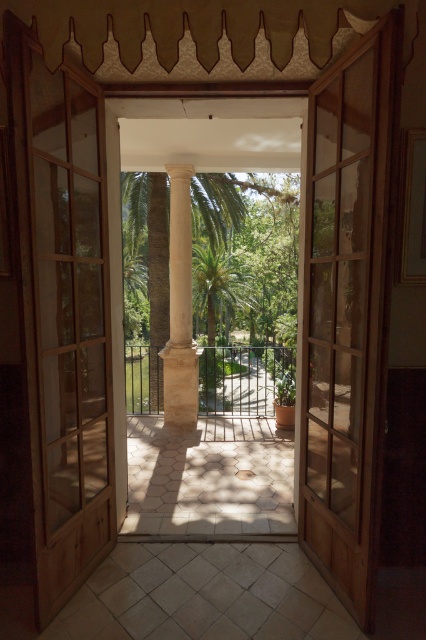
Between clear wood glass door at center and wooden door at center, which one has less height?

With less height is clear wood glass door at center.

Is clear wood glass door at center taller than wooden door at center?

Incorrect, clear wood glass door at center's height is not larger of wooden door at center's.

Which is in front, point (45, 525) or point (348, 96)?

Point (45, 525) is in front.

Identify the location of clear wood glass door at center. (66, 323).

Between clear wood glass door at center and white stone column at center, which one appears on the left side from the viewer's perspective?

clear wood glass door at center is more to the left.

Is point (54, 410) behind point (190, 324)?

That is False.

I want to click on clear wood glass door at center, so click(x=66, y=323).

Is wooden door at center to the right of white stone column at center from the viewer's perspective?

Correct, you'll find wooden door at center to the right of white stone column at center.

Image resolution: width=426 pixels, height=640 pixels. What do you see at coordinates (345, 316) in the screenshot?
I see `wooden door at center` at bounding box center [345, 316].

You are a GUI agent. You are given a task and a screenshot of the screen. Output one action in this format:
    pyautogui.click(x=<x>, y=<y>)
    Task: Click on the wooden door at center
    
    Given the screenshot: What is the action you would take?
    pyautogui.click(x=345, y=316)